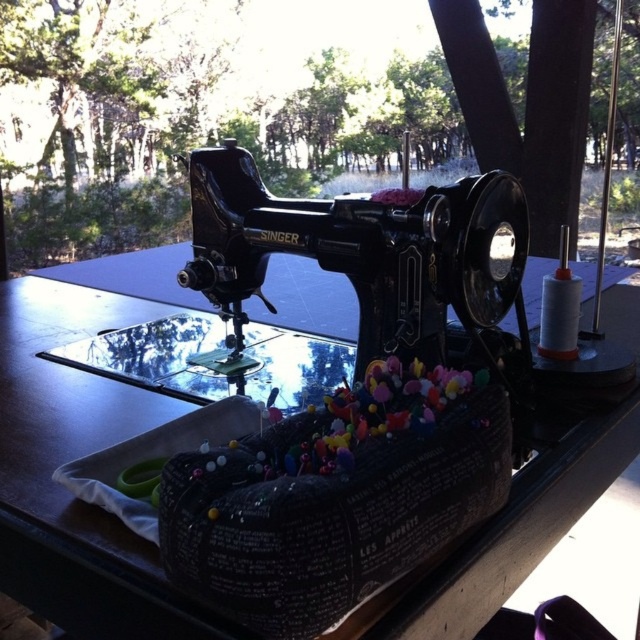
Between black wood table at center and transparent glass table at center, which one is positioned lower?

transparent glass table at center is lower down.

In the scene shown: Which of these two, black wood table at center or transparent glass table at center, stands taller?

With more height is black wood table at center.

Is point (54, 410) positioned after point (182, 324)?

No, it is in front of (182, 324).

This screenshot has width=640, height=640. In order to click on black wood table at center in this screenshot , I will do `click(83, 449)`.

Is point (90, 387) more distant than point (394, 221)?

Yes, point (90, 387) is behind point (394, 221).

Between point (125, 396) and point (243, 204), which one is positioned in front?

Positioned in front is point (125, 396).

Locate an element on the screen. Image resolution: width=640 pixels, height=640 pixels. black wood table at center is located at coordinates (83, 449).

Does black wood table at center have a smaller size compared to black fabric with pins at center?

Incorrect, black wood table at center is not smaller in size than black fabric with pins at center.

Who is more forward, (524,472) or (307,563)?

Positioned in front is point (307,563).

Find the location of a particular element. black wood table at center is located at coordinates (83, 449).